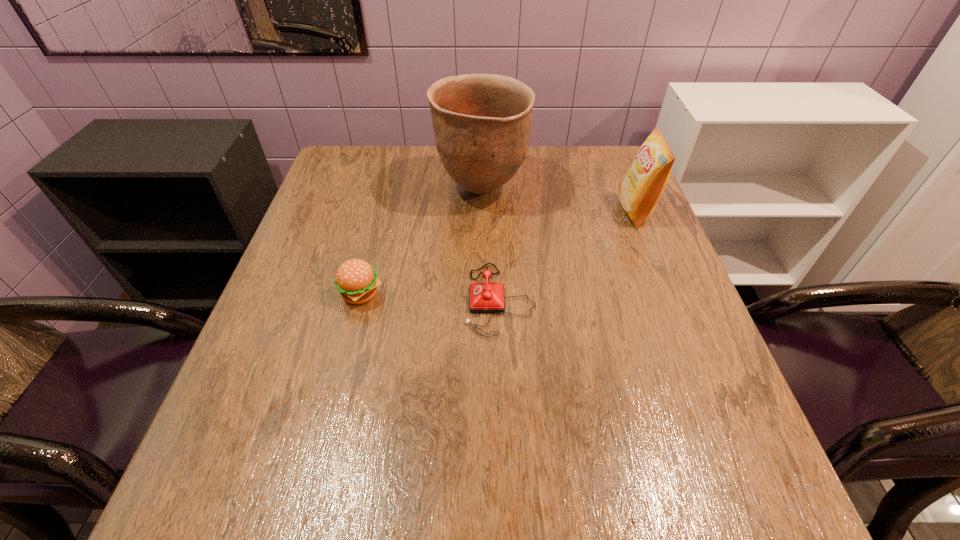
In the image, there is a desktop. Where is `vacant region at the right edge`? This screenshot has width=960, height=540. vacant region at the right edge is located at coordinates (586, 193).

In the image, there is a desktop. Where is `vacant area at the far left corner`? vacant area at the far left corner is located at coordinates (342, 145).

Image resolution: width=960 pixels, height=540 pixels. Identify the location of vacant region at the near left corner. (283, 480).

At what (x,y) coordinates should I click in order to perform the action: click on free space between the second tallest object and the hamburger. Please return your answer as a coordinate pair (x, y). Image resolution: width=960 pixels, height=540 pixels. Looking at the image, I should click on (498, 253).

The width and height of the screenshot is (960, 540). In order to click on vacant point located between the shortest object and the tallest object in this screenshot , I will do `click(491, 245)`.

Where is `free space between the telephone and the pottery`? free space between the telephone and the pottery is located at coordinates (491, 245).

Identify the location of unoccupied position between the shortest object and the crisp (potato chip). (567, 255).

The width and height of the screenshot is (960, 540). In order to click on empty location between the third shortest object and the telephone in this screenshot , I will do 567,255.

The image size is (960, 540). In order to click on vacant region between the hamburger and the tallest object in this screenshot , I will do `click(420, 242)`.

This screenshot has height=540, width=960. I want to click on unoccupied position between the leftmost object and the pottery, so click(420, 242).